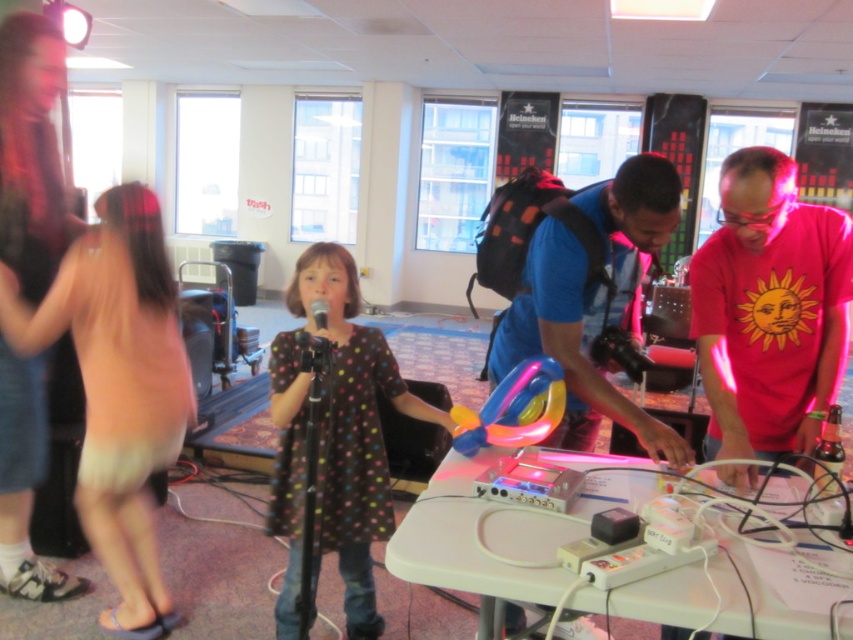
Between point (788, 214) and point (316, 324), which one is positioned behind?

Positioned behind is point (316, 324).

Is sun-printed t-shirt at right bigger than black matte microphone at center?

Indeed, sun-printed t-shirt at right has a larger size compared to black matte microphone at center.

Find the location of `sun-printed t-shirt at right`. sun-printed t-shirt at right is located at coordinates (769, 308).

Can you confirm if translucent neon balloon at center is wider than black matte microphone at center?

Yes.

In the scene shown: Who is shorter, translucent neon balloon at center or black matte microphone at center?

Standing shorter between the two is black matte microphone at center.

Does point (548, 396) come in front of point (321, 307)?

That is True.

I want to click on translucent neon balloon at center, so click(514, 408).

Which is in front, point (781, 220) or point (349, 445)?

Point (781, 220) is more forward.

Does point (749, 252) come behind point (322, 520)?

No, it is not.

Is point (784, 392) positioned before point (338, 324)?

That is True.

Find the location of a particular element. The image size is (853, 640). sun-printed t-shirt at right is located at coordinates (769, 308).